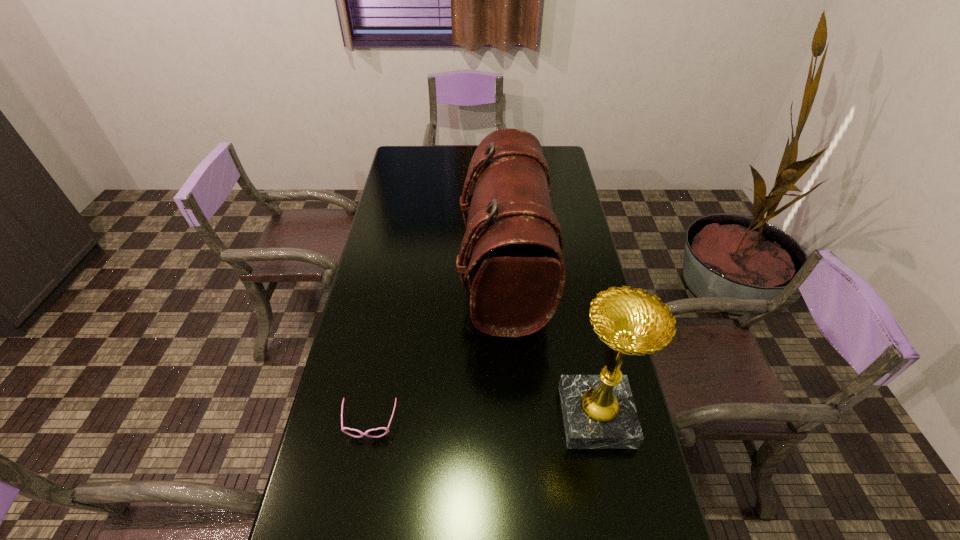
The width and height of the screenshot is (960, 540). Find the location of `satchel`. satchel is located at coordinates (518, 277).

Locate an element on the screen. The height and width of the screenshot is (540, 960). award is located at coordinates (599, 412).

Identify the location of sunglasses. (379, 432).

This screenshot has width=960, height=540. Find the location of `the leftmost object`. the leftmost object is located at coordinates (379, 432).

Locate an element on the screen. The height and width of the screenshot is (540, 960). blank space located on the front-facing side of the farthest object is located at coordinates (399, 273).

This screenshot has height=540, width=960. Identify the location of vacant position located on the front-facing side of the farthest object. (394, 273).

The image size is (960, 540). Find the location of `free region located 0.280m on the front-facing side of the farthest object`. free region located 0.280m on the front-facing side of the farthest object is located at coordinates (379, 273).

Identify the location of free space located 0.370m on the front-facing side of the award. (420, 416).

Image resolution: width=960 pixels, height=540 pixels. Identify the location of vacant area situated on the front-facing side of the award. (436, 416).

I want to click on free location located 0.180m on the front-facing side of the award, so click(493, 416).